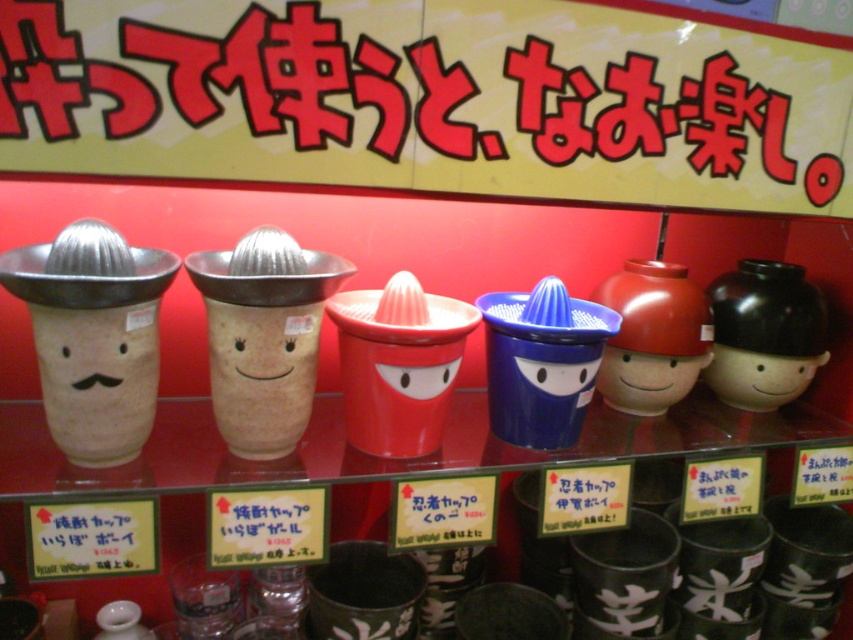
You are organizing a kitchen display and need to know the spatial relationship between the brushed metal sign at upper center and the matte ceramic bowl at right. Based on the scene description, which object is positioned higher?

The brushed metal sign at upper center is located above the matte ceramic bowl at right, so it is positioned higher.

You are setting up a kitchen display and need to arrange the matte ceramic bowl at right and the matte ceramic cup at center. If you want to place a small decorative item on top of one of them, which one would be more stable to use as a base?

The matte ceramic bowl at right is much taller than the matte ceramic cup at center, so it would provide a more stable base for placing a small decorative item on top.

You are organizing a shelf of citrus juicers and notice two items, the matte ceramic face at left and the matte ceramic cup at center. Which one is located to the right of the other?

The matte ceramic cup at center is to the right of the matte ceramic face at left because the matte ceramic face at left is positioned on the left side of matte ceramic cup at center.